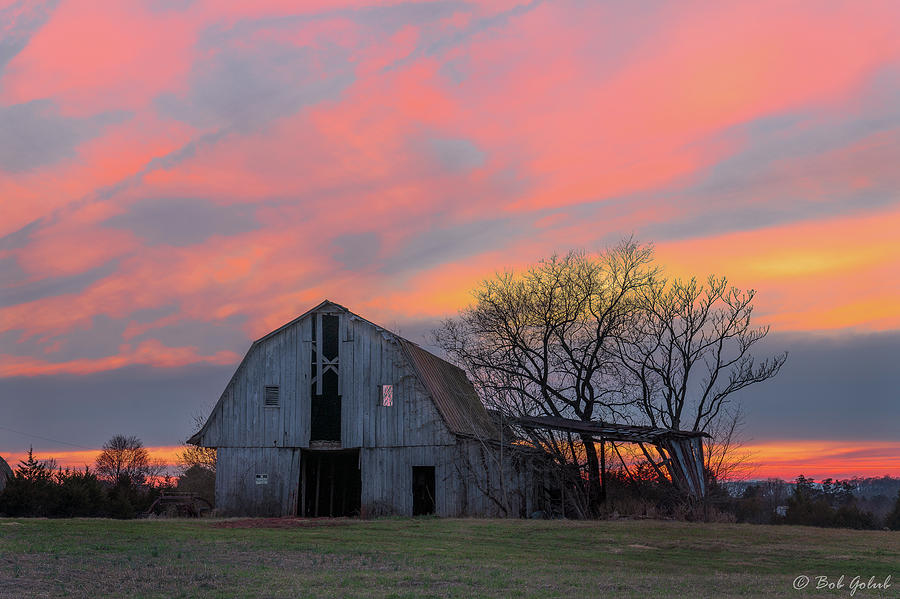
I want to click on doorway, so click(x=426, y=496).